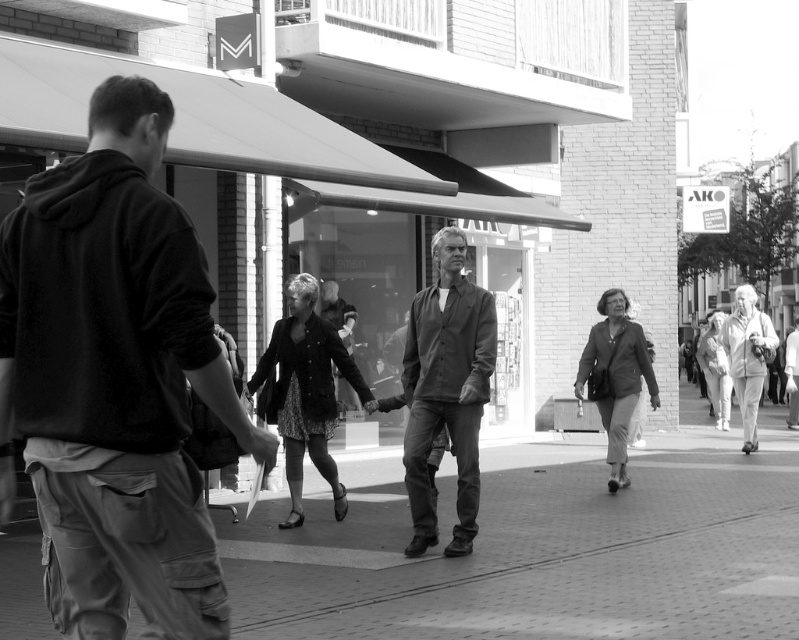
Does brick pavement at center appear under dark gray textured shirt at center?

Indeed, brick pavement at center is positioned under dark gray textured shirt at center.

Is point (609, 545) positioned in front of point (455, 330)?

No, (609, 545) is further to viewer.

Identify the location of brick pavement at center. (539, 548).

Looking at this image, does dark gray hoodie at left appear under dark gray textured shirt at center?

No, dark gray hoodie at left is not below dark gray textured shirt at center.

Which is more to the right, dark gray hoodie at left or dark gray textured shirt at center?

dark gray textured shirt at center

The width and height of the screenshot is (799, 640). I want to click on dark gray hoodie at left, so click(114, 378).

Which of these two, brick pavement at center or dark gray hoodie at left, stands shorter?

With less height is brick pavement at center.

Is brick pavement at center above dark gray hoodie at left?

No.

Where is `brick pavement at center`? The width and height of the screenshot is (799, 640). brick pavement at center is located at coordinates (539, 548).